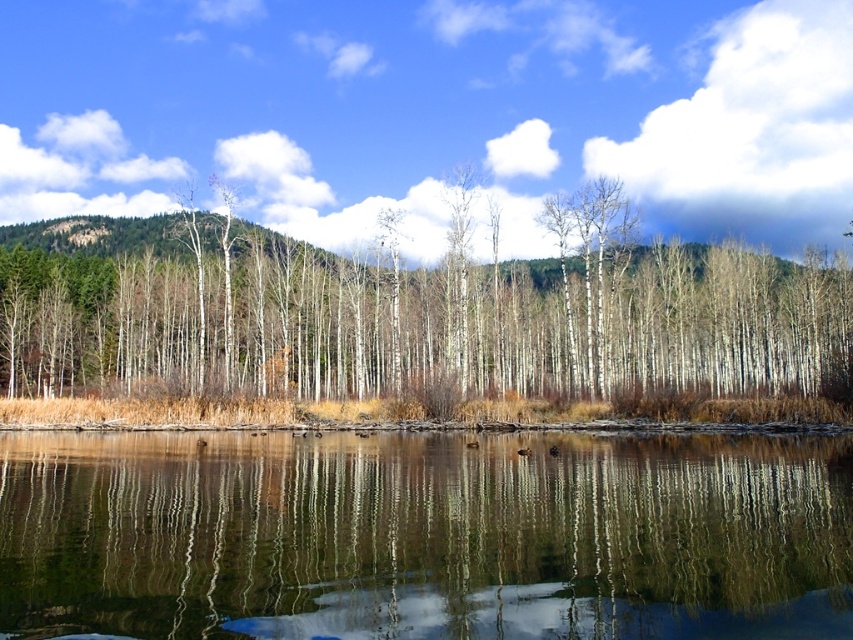
Who is taller, transparent water at center or white smooth trees at center?

white smooth trees at center

Is transparent water at center above white smooth trees at center?

Actually, transparent water at center is below white smooth trees at center.

You are a GUI agent. You are given a task and a screenshot of the screen. Output one action in this format:
    pyautogui.click(x=<x>, y=<y>)
    Task: Click on the transparent water at center
    
    Given the screenshot: What is the action you would take?
    pyautogui.click(x=424, y=538)